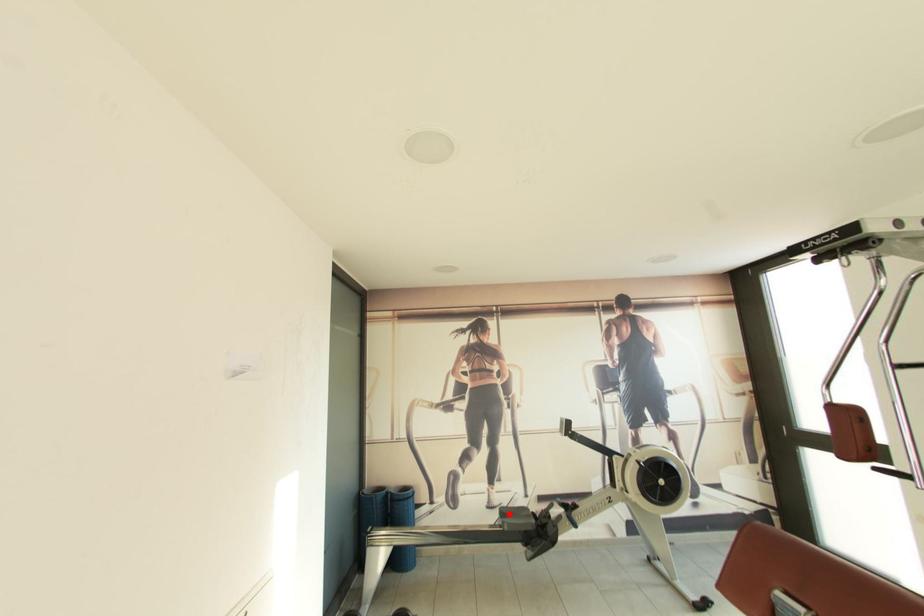
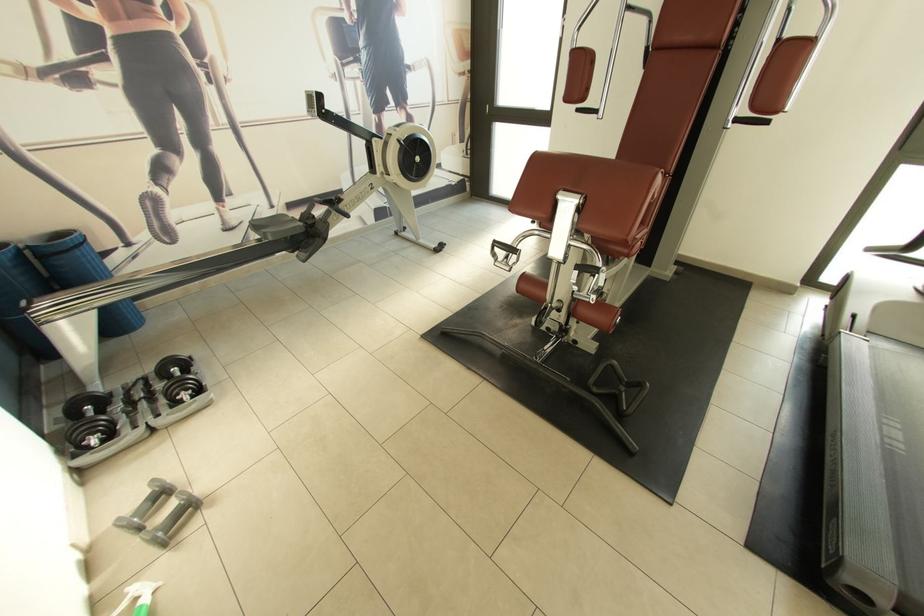
Question: I am providing you with two images of the same scene from different viewpoints. A red point is marked on the first image. Can you still see the location of the red point in image 2?

Choices:
 (A) Yes
 (B) No

Answer: (A)